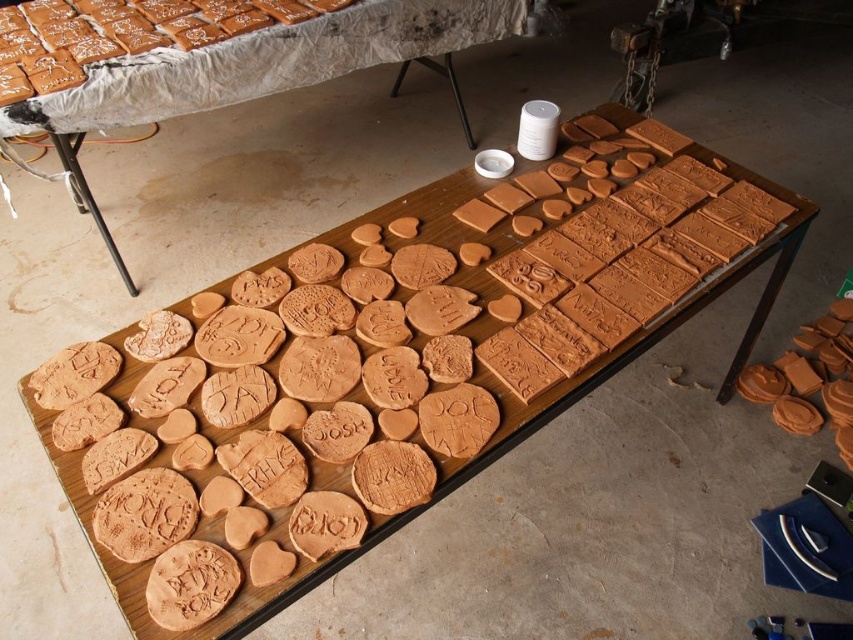
You are standing in front of the wooden table with clay pieces. There are two points marked on the table, point A at coordinates point [254,68] and point B at coordinates point [527,136]. Which point is closer to you?

Point point [254,68] is closer to you because it is further to the viewer than point point [527,136].

You are a baker who needs to stack the matte brown gingerbread at upper left and the matte clay cookie at right on top of each other. Which one should be placed at the bottom to ensure stability?

The matte brown gingerbread at upper left has a greater height compared to the matte clay cookie at right, so placing the taller matte brown gingerbread at upper left at the bottom would provide a stable base for the shorter matte clay cookie at right.